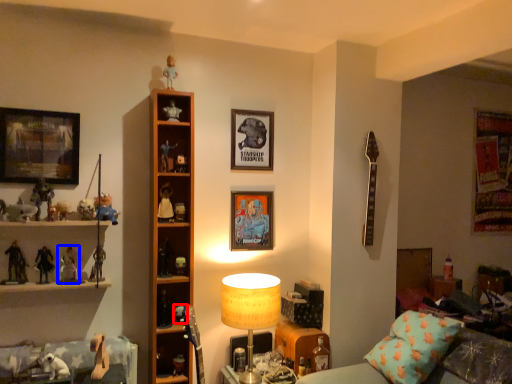
Question: Among these objects, which one is nearest to the camera, toy (highlighted by a red box) or toy (highlighted by a blue box)?

Choices:
 (A) toy
 (B) toy

Answer: (B)